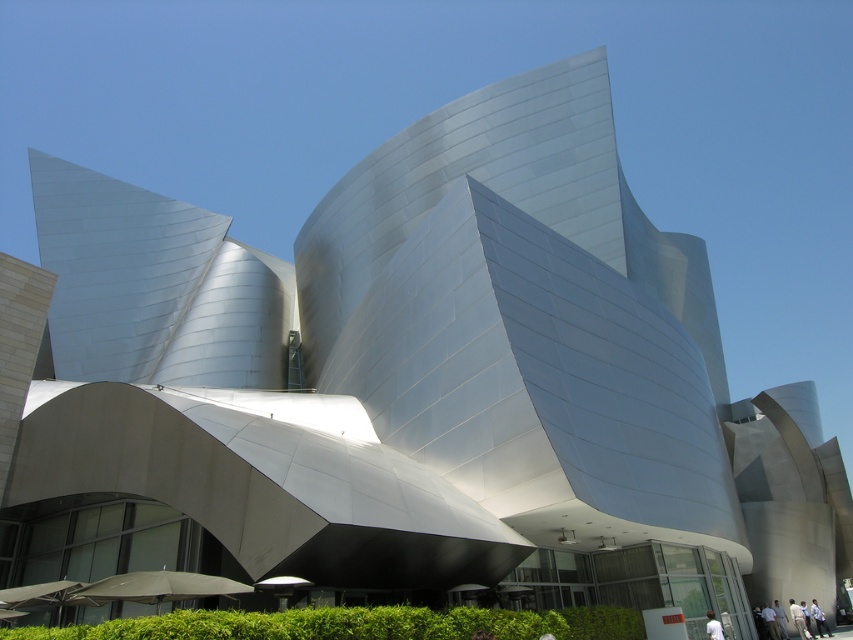
You are standing at the entrance of the Walt Disney Concert Hall and see a white matte person at lower right and a light blue shirt at lower right. Which object takes up more space in the image?

The light blue shirt at lower right takes up more space in the image than the white matte person at lower right because the white matte person at lower right occupies less space than light blue shirt at lower right.